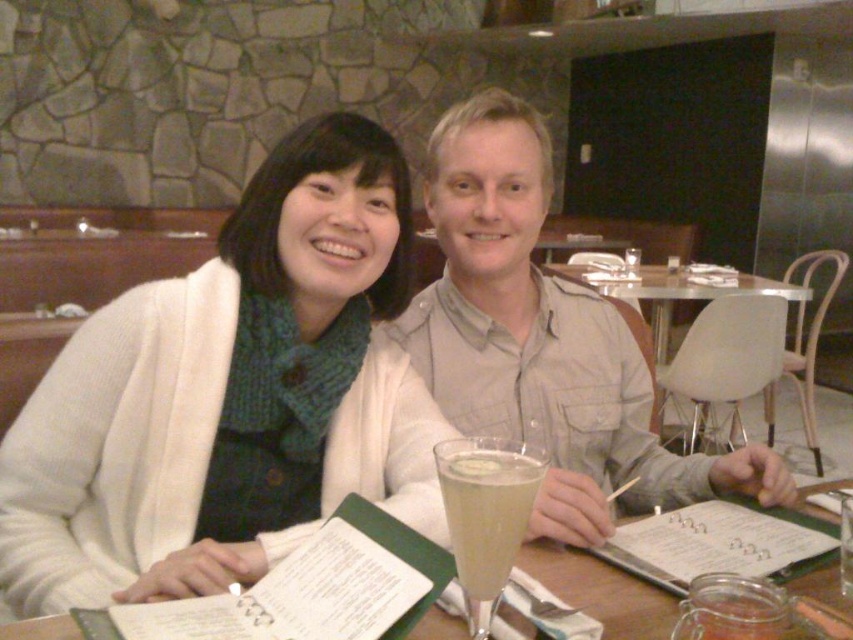
Looking at this image, is white knit sweater at upper left bigger than white plastic chair at center?

Actually, white knit sweater at upper left might be smaller than white plastic chair at center.

From the picture: Is white knit sweater at upper left shorter than white plastic chair at center?

Incorrect, white knit sweater at upper left's height does not fall short of white plastic chair at center's.

Between point (399, 493) and point (785, 289), which one is positioned in front?

Point (399, 493) is in front.

Where is `white knit sweater at upper left`? white knit sweater at upper left is located at coordinates (230, 396).

Is white knit sweater at upper left above clear glass table at center?

Indeed, white knit sweater at upper left is positioned over clear glass table at center.

Can you confirm if white knit sweater at upper left is shorter than clear glass table at center?

No, white knit sweater at upper left is not shorter than clear glass table at center.

Locate an element on the screen. The height and width of the screenshot is (640, 853). white knit sweater at upper left is located at coordinates (230, 396).

The height and width of the screenshot is (640, 853). In order to click on white knit sweater at upper left in this screenshot , I will do `click(230, 396)`.

Between matte gray shirt at center and clear glass champagne flute at center, which one has more height?

matte gray shirt at center

Is matte gray shirt at center below clear glass champagne flute at center?

No.

Find the location of a particular element. The width and height of the screenshot is (853, 640). matte gray shirt at center is located at coordinates (x=543, y=339).